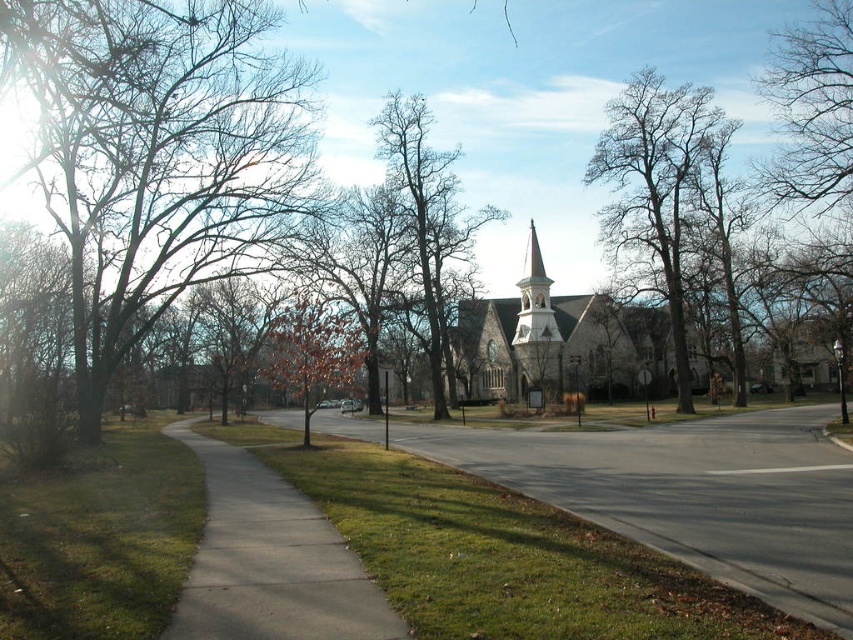
From the picture: Who is more distant from viewer, (329, 385) or (541, 380)?

Point (541, 380)

Identify the location of brown leafy tree at center. click(312, 353).

Where is `gray asphalt sidewalk at center`? gray asphalt sidewalk at center is located at coordinates (691, 493).

Can you confirm if gray asphalt sidewalk at center is shorter than gray stone spire at center?

Yes.

The width and height of the screenshot is (853, 640). Identify the location of gray asphalt sidewalk at center. (691, 493).

Does brown leafy tree at left appear over gray asphalt sidewalk at center?

Correct, brown leafy tree at left is located above gray asphalt sidewalk at center.

Which of these two, brown leafy tree at left or gray asphalt sidewalk at center, stands shorter?

gray asphalt sidewalk at center is shorter.

Who is more forward, (283,180) or (614,440)?

Point (614,440) is more forward.

This screenshot has height=640, width=853. Find the location of `brown leafy tree at left`. brown leafy tree at left is located at coordinates (160, 156).